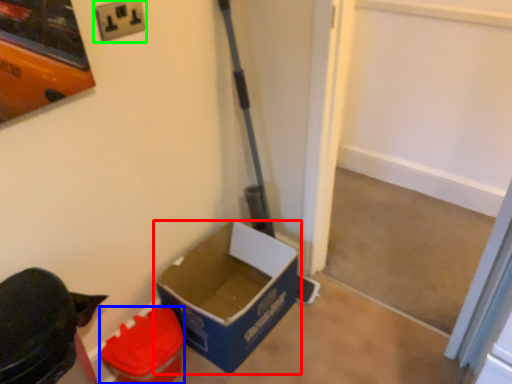
Question: Based on their relative distances, which object is farther from box (highlighted by a red box)? Choose from box (highlighted by a blue box) and electric outlet (highlighted by a green box).

Choices:
 (A) box
 (B) electric outlet

Answer: (B)